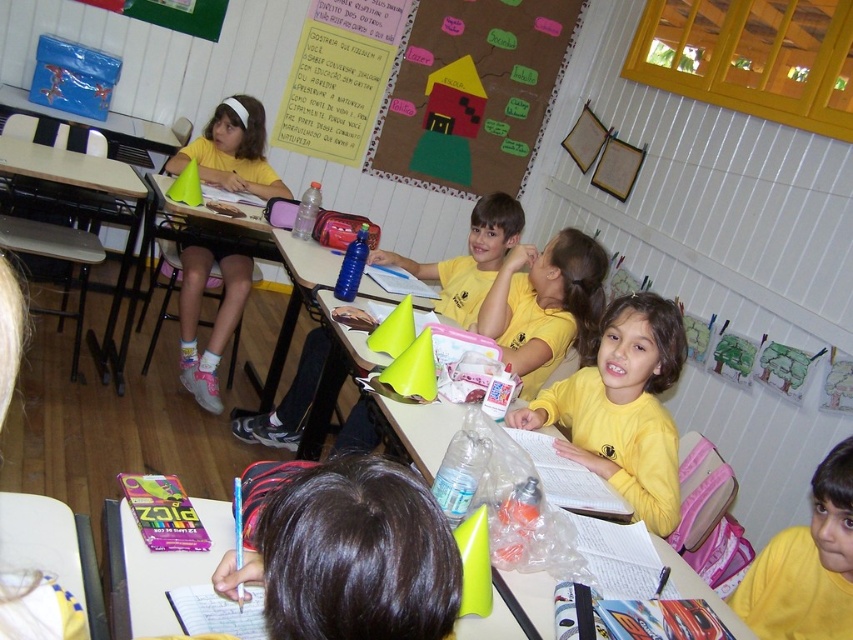
Who is taller, brown hair at center or yellow matte shirt at lower right?

Standing taller between the two is yellow matte shirt at lower right.

This screenshot has height=640, width=853. In order to click on brown hair at center in this screenshot , I will do [x=346, y=552].

Does brown hair at center appear on the right side of matte yellow shirt at left?

Indeed, brown hair at center is positioned on the right side of matte yellow shirt at left.

Can you confirm if brown hair at center is shorter than matte yellow shirt at left?

Yes, brown hair at center is shorter than matte yellow shirt at left.

You are a GUI agent. You are given a task and a screenshot of the screen. Output one action in this format:
    pyautogui.click(x=<x>, y=<y>)
    Task: Click on the brown hair at center
    The width and height of the screenshot is (853, 640).
    Given the screenshot: What is the action you would take?
    pyautogui.click(x=346, y=552)

Where is `brown hair at center`? brown hair at center is located at coordinates (346, 552).

Which is more to the left, yellow matte shirt at center or matte yellow shirt at left?

From the viewer's perspective, matte yellow shirt at left appears more on the left side.

This screenshot has height=640, width=853. What are the coordinates of `yellow matte shirt at center` in the screenshot? It's located at (624, 406).

Image resolution: width=853 pixels, height=640 pixels. Describe the element at coordinates (624, 406) in the screenshot. I see `yellow matte shirt at center` at that location.

The width and height of the screenshot is (853, 640). Identify the location of yellow matte shirt at center. (624, 406).